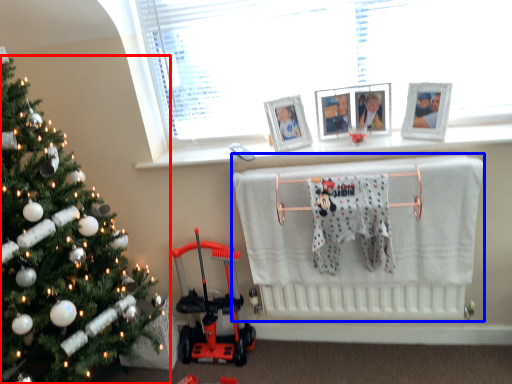
Question: Among these objects, which one is nearest to the camera, christmas tree (highlighted by a red box) or infant bed (highlighted by a blue box)?

Choices:
 (A) christmas tree
 (B) infant bed

Answer: (A)